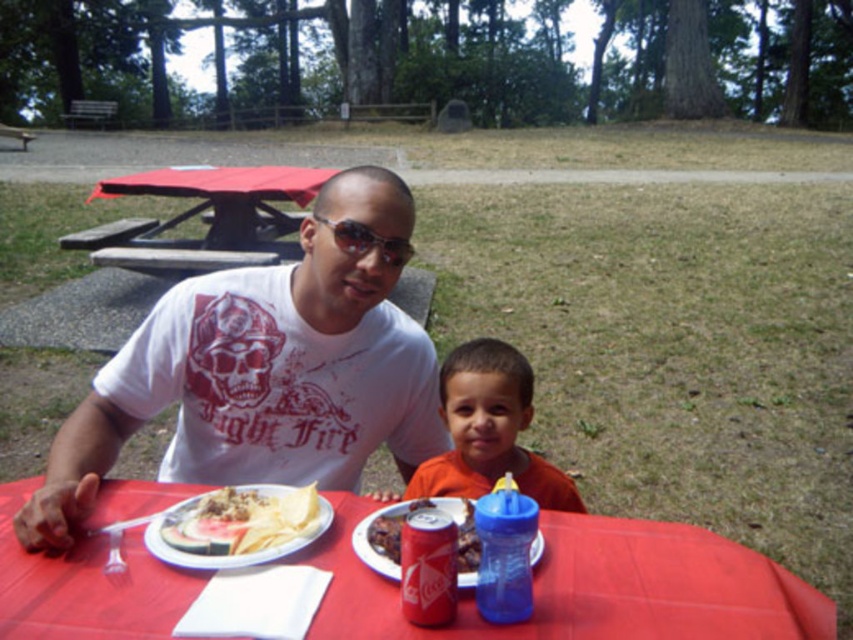
Question: Is red plastic picnic table at upper left positioned in front of white paper plate with chips and meat at center?

Choices:
 (A) no
 (B) yes

Answer: (A)

Question: Which object is the closest to the blue plastic sippy cup at lower right?

Choices:
 (A) red plastic table at center
 (B) red plastic picnic table at upper left

Answer: (A)

Question: Does red plastic table at center appear on the left side of red plastic picnic table at upper left?

Choices:
 (A) yes
 (B) no

Answer: (B)

Question: Which point is farther to the camera?

Choices:
 (A) red matte coca-cola can at center
 (B) white matte t-shirt at center
 (C) white paper plate with chips and meat at center

Answer: (B)

Question: Is the position of red plastic table at center more distant than that of sunglasses at center?

Choices:
 (A) yes
 (B) no

Answer: (B)

Question: Based on their relative distances, which object is nearer to the sunglasses at center?

Choices:
 (A) shiny plastic soda can at center
 (B) blue plastic sippy cup at lower right
 (C) red matte coca-cola can at center

Answer: (A)